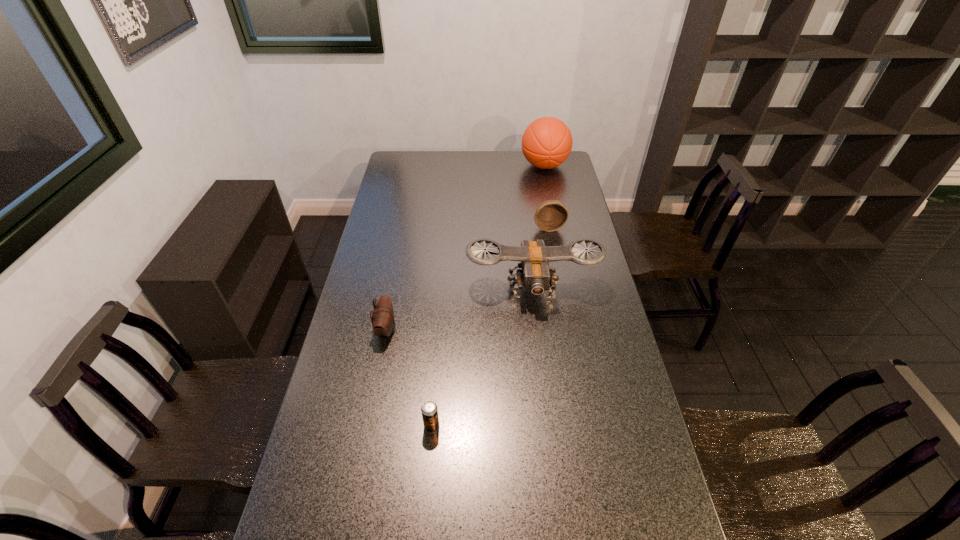
Identify the location of vacant area that lies between the nearest object and the drone. The width and height of the screenshot is (960, 540). (482, 357).

This screenshot has height=540, width=960. I want to click on free space between the bowl and the nearest object, so click(x=491, y=327).

The image size is (960, 540). I want to click on free space between the second object from left to right and the third farthest object, so click(482, 357).

Point out which object is positioned as the third nearest to the second object from left to right. Please provide its 2D coordinates. Your answer should be formatted as a tuple, i.e. [(x, y)], where the tuple contains the x and y coordinates of a point satisfying the conditions above.

[(551, 215)]

This screenshot has height=540, width=960. In order to click on object that ranks as the fourth closest to the third farthest object in this screenshot , I will do `click(547, 142)`.

Where is `free location that satisfies the following two spatial constraints: 1. on the back side of the tallest object; 2. on the left side of the beer can`? free location that satisfies the following two spatial constraints: 1. on the back side of the tallest object; 2. on the left side of the beer can is located at coordinates (453, 166).

Identify the location of blank area in the image that satisfies the following two spatial constraints: 1. on the back side of the third tallest object; 2. on the right side of the tallest object. (538, 166).

Where is `free space that satisfies the following two spatial constraints: 1. on the back side of the nearest object; 2. with the flap open on the fourth farthest object`? free space that satisfies the following two spatial constraints: 1. on the back side of the nearest object; 2. with the flap open on the fourth farthest object is located at coordinates (440, 329).

You are a GUI agent. You are given a task and a screenshot of the screen. Output one action in this format:
    pyautogui.click(x=<x>, y=<y>)
    Task: Click on the vacant space that satisfies the following two spatial constraints: 1. on the back side of the third shortest object; 2. on the right side of the second object from left to right
    The image size is (960, 540).
    Given the screenshot: What is the action you would take?
    [x=448, y=227]